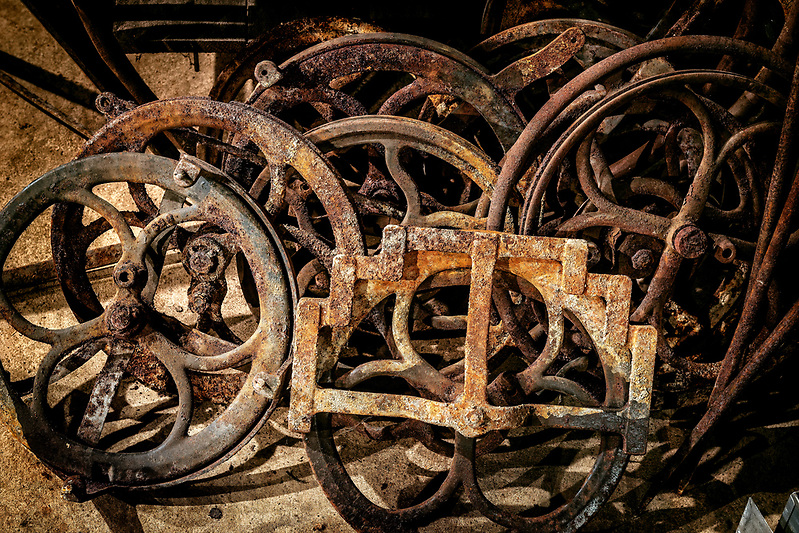
This screenshot has height=533, width=799. I want to click on screws, so click(179, 177), click(118, 316), click(201, 309), click(199, 262), click(486, 419), click(678, 248), click(630, 262).